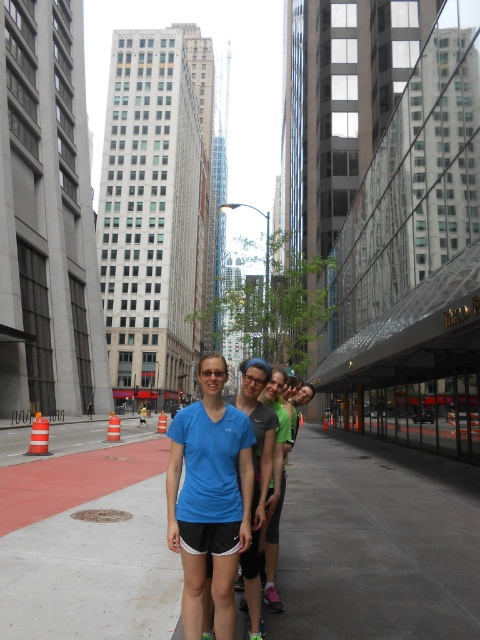
Question: Can you confirm if gray concrete pavement at center is positioned above blue fabric shorts at center?

Choices:
 (A) no
 (B) yes

Answer: (A)

Question: Considering the relative positions of gray concrete pavement at center and blue fabric shorts at center in the image provided, where is gray concrete pavement at center located with respect to blue fabric shorts at center?

Choices:
 (A) left
 (B) right

Answer: (B)

Question: Can you confirm if gray concrete pavement at center is thinner than blue fabric shorts at center?

Choices:
 (A) no
 (B) yes

Answer: (A)

Question: Which of the following is the farthest from the observer?

Choices:
 (A) (181, 486)
 (B) (398, 513)

Answer: (B)

Question: Which point is closer to the camera taking this photo?

Choices:
 (A) (478, 540)
 (B) (206, 492)

Answer: (B)